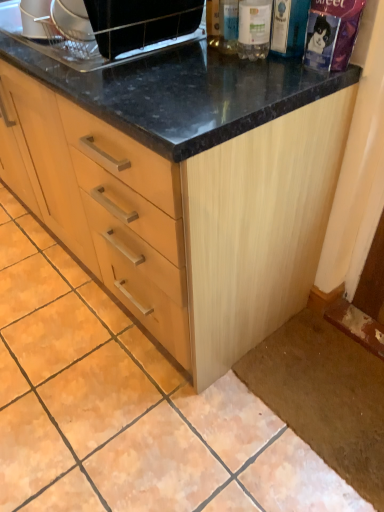
Image resolution: width=384 pixels, height=512 pixels. Find the location of `blank space to the left of transparent plastic bottle at upper right, acting as the third bottle starting from the left`. blank space to the left of transparent plastic bottle at upper right, acting as the third bottle starting from the left is located at coordinates (214, 65).